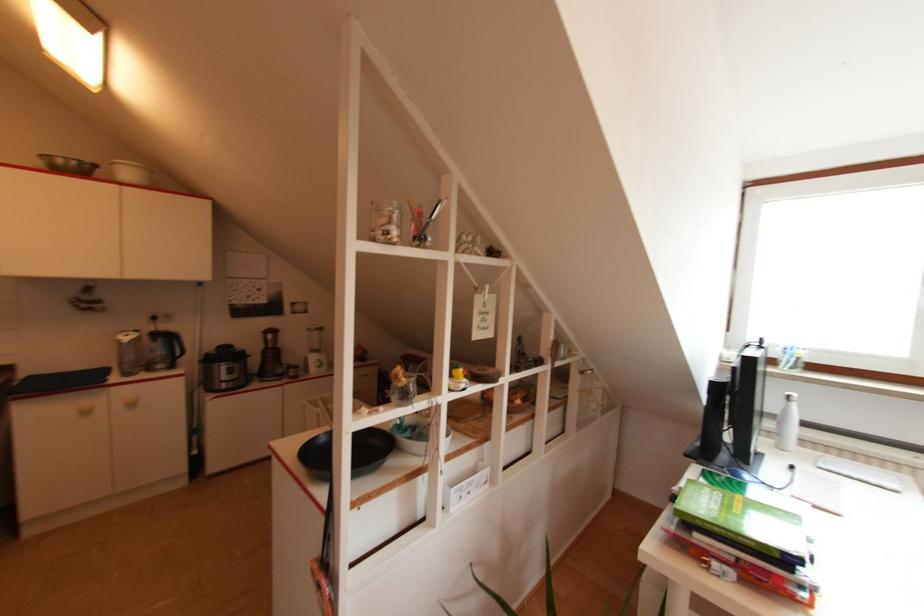
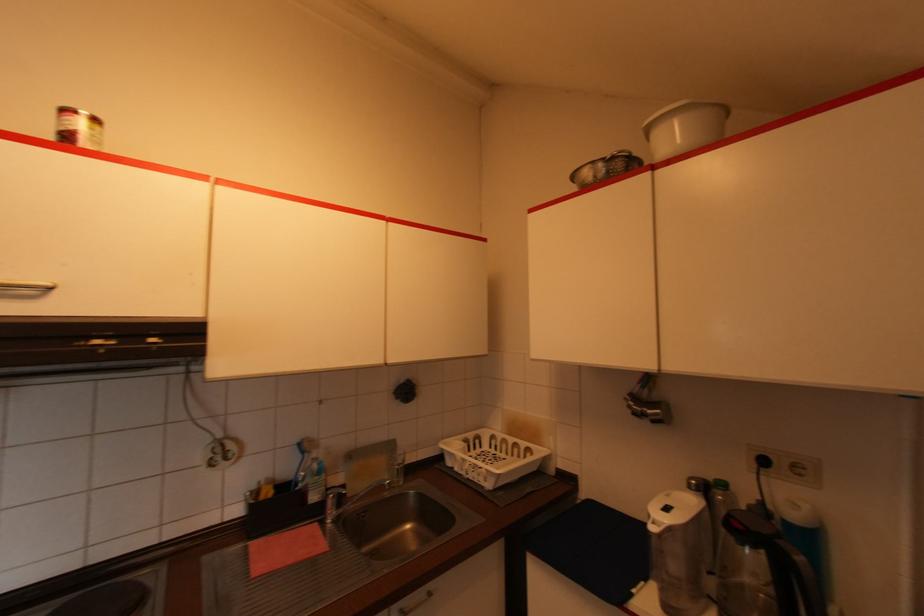
Where in the second image is the point corresponding to (128,334) from the first image?

(666, 511)